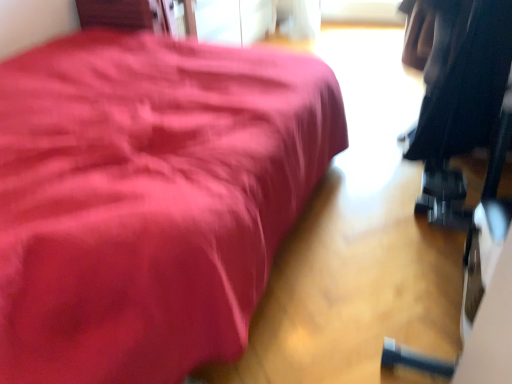
Question: From a real-world perspective, does black fabric at right sit lower than matte black dumbbell at lower right?

Choices:
 (A) yes
 (B) no

Answer: (B)

Question: From a real-world perspective, is black fabric at right physically above matte black dumbbell at lower right?

Choices:
 (A) no
 (B) yes

Answer: (B)

Question: Considering the relative sizes of black fabric at right and matte black dumbbell at lower right in the image provided, is black fabric at right shorter than matte black dumbbell at lower right?

Choices:
 (A) yes
 (B) no

Answer: (B)

Question: Is black fabric at right turned away from matte black dumbbell at lower right?

Choices:
 (A) no
 (B) yes

Answer: (A)

Question: Does black fabric at right have a greater height compared to matte black dumbbell at lower right?

Choices:
 (A) no
 (B) yes

Answer: (B)

Question: From the image's perspective, does black fabric at right appear lower than matte black dumbbell at lower right?

Choices:
 (A) no
 (B) yes

Answer: (B)

Question: From the image's perspective, is matte black dumbbell at lower right beneath black fabric at right?

Choices:
 (A) no
 (B) yes

Answer: (A)

Question: Is matte black dumbbell at lower right closer to camera compared to black fabric at right?

Choices:
 (A) yes
 (B) no

Answer: (A)

Question: From a real-world perspective, is matte black dumbbell at lower right positioned over black fabric at right based on gravity?

Choices:
 (A) yes
 (B) no

Answer: (B)

Question: Is matte black dumbbell at lower right at the right side of black fabric at right?

Choices:
 (A) yes
 (B) no

Answer: (B)

Question: From a real-world perspective, does matte black dumbbell at lower right sit lower than black fabric at right?

Choices:
 (A) no
 (B) yes

Answer: (B)

Question: Is matte black dumbbell at lower right positioned beyond the bounds of black fabric at right?

Choices:
 (A) yes
 (B) no

Answer: (A)

Question: From the image's perspective, relative to black fabric at right, is matte black dumbbell at lower right above or below?

Choices:
 (A) below
 (B) above

Answer: (B)